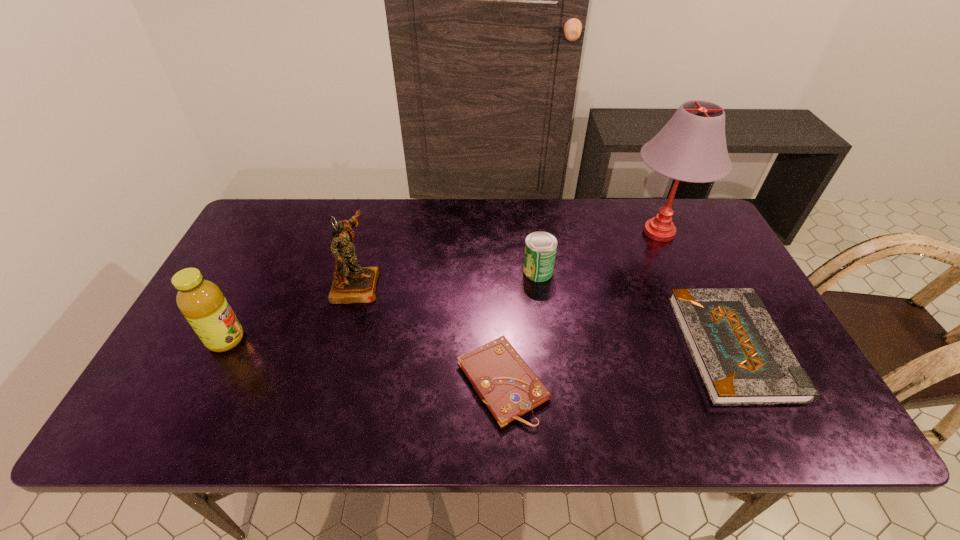
Where is `notebook that is at the right edge`? notebook that is at the right edge is located at coordinates (742, 358).

The image size is (960, 540). I want to click on object that is at the far right corner, so click(691, 147).

Identify the location of object that is at the near right corner. (742, 358).

You are a GUI agent. You are given a task and a screenshot of the screen. Output one action in this format:
    pyautogui.click(x=<x>, y=<y>)
    Task: Click on the vacant area at the far edge
    
    Given the screenshot: What is the action you would take?
    pyautogui.click(x=512, y=225)

In the image, there is a desktop. Where is `vacant space at the near edge`? vacant space at the near edge is located at coordinates (738, 421).

At what (x,y) coordinates should I click in order to perform the action: click on vacant space at the left edge of the desktop. Please return your answer as a coordinate pair (x, y). Looking at the image, I should click on (240, 301).

In the image, there is a desktop. At what (x,y) coordinates should I click in order to perform the action: click on vacant space at the right edge. Please return your answer as a coordinate pair (x, y). The height and width of the screenshot is (540, 960). Looking at the image, I should click on (682, 267).

Where is `free space at the far left corner`? free space at the far left corner is located at coordinates (295, 227).

The image size is (960, 540). In the image, there is a desktop. Find the location of `vacant space at the far right corner`. vacant space at the far right corner is located at coordinates (674, 204).

The width and height of the screenshot is (960, 540). Find the location of `empty space between the can and the fruit juice`. empty space between the can and the fruit juice is located at coordinates (382, 305).